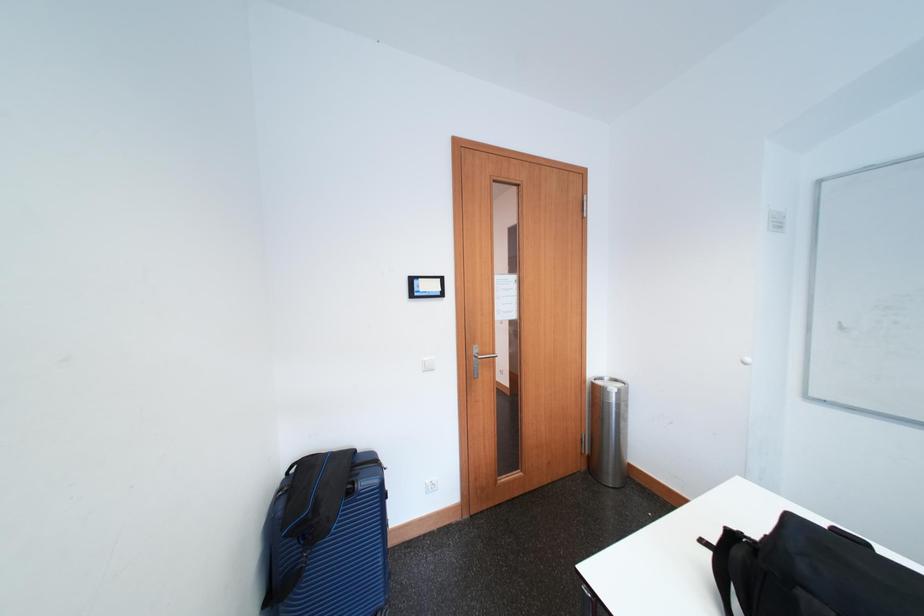
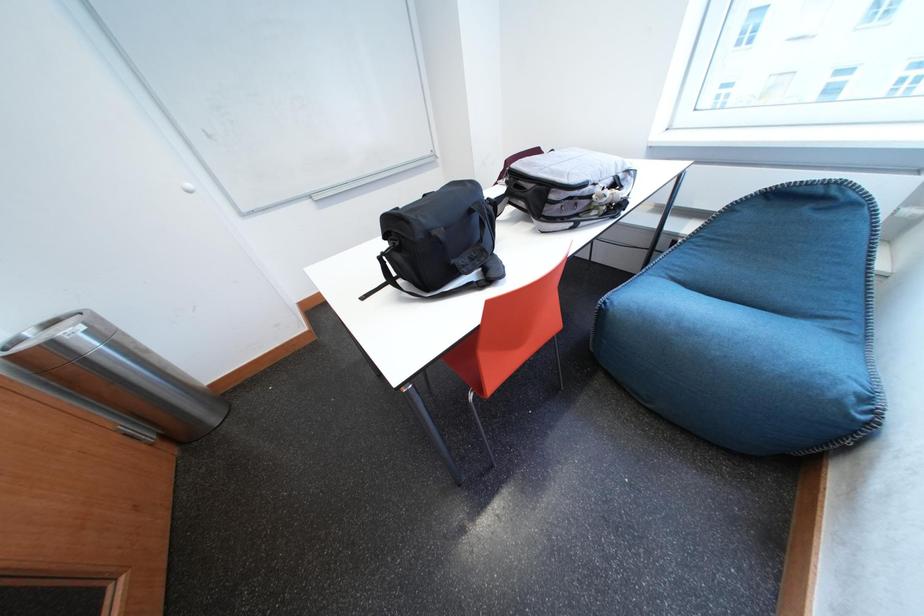
How did the camera likely rotate?

The rotation direction of the camera is right-down.